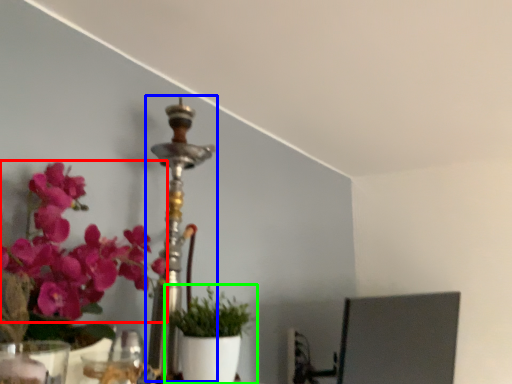
Question: Which object is the closest to the flower (highlighted by a red box)? Choose among these: candle holder (highlighted by a blue box) or houseplant (highlighted by a green box).

Choices:
 (A) candle holder
 (B) houseplant

Answer: (A)